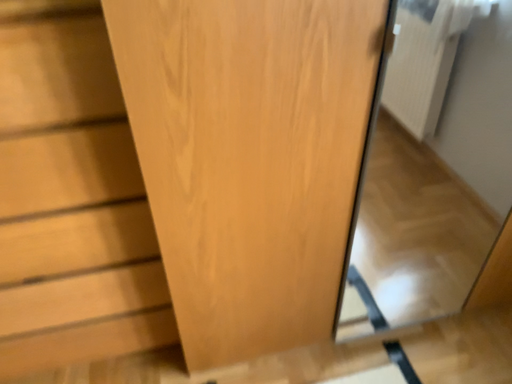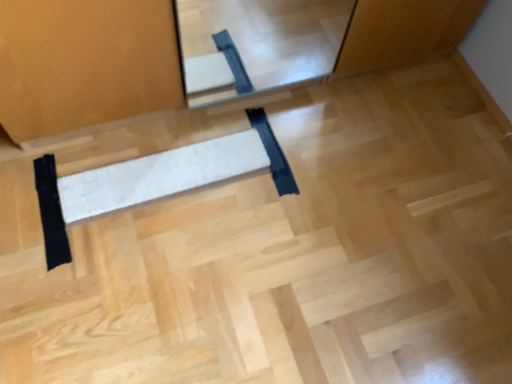
Question: Which way did the camera rotate in the video?

Choices:
 (A) rotated right
 (B) rotated left

Answer: (A)